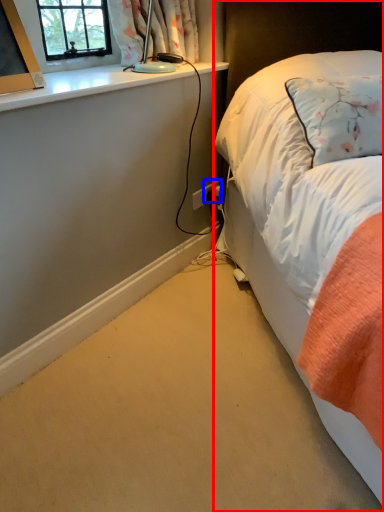
Question: Which object appears farthest to the camera in this image, bed (highlighted by a red box) or power plugs and sockets (highlighted by a blue box)?

Choices:
 (A) bed
 (B) power plugs and sockets

Answer: (B)